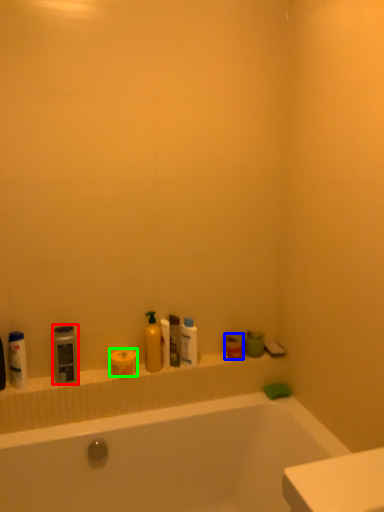
Question: Considering the real-world distances, which object is closest to cleaning product (highlighted by a red box)? mouthwash (highlighted by a blue box) or toilet paper (highlighted by a green box).

Choices:
 (A) mouthwash
 (B) toilet paper

Answer: (B)